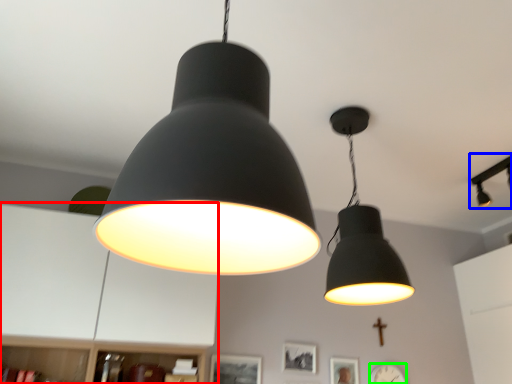
Question: Which object is the farthest from dresser (highlighted by a red box)? Choose among these: lamp (highlighted by a blue box) or clock (highlighted by a green box).

Choices:
 (A) lamp
 (B) clock

Answer: (A)